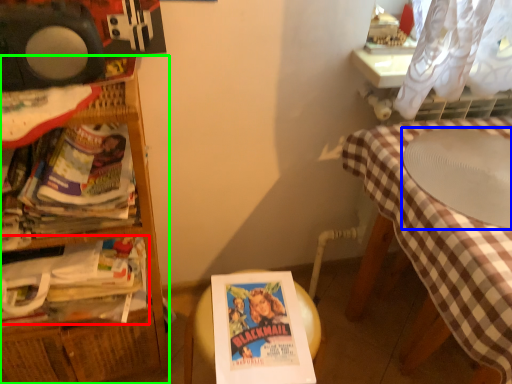
Question: Considering the real-world distances, which object is farthest from book (highlighted by a red box)? round table (highlighted by a blue box) or furniture (highlighted by a green box)?

Choices:
 (A) round table
 (B) furniture

Answer: (A)